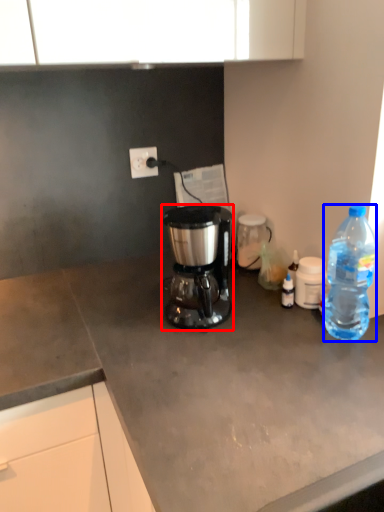
Question: Which object appears farthest to the camera in this image, coffee maker (highlighted by a red box) or bottle (highlighted by a blue box)?

Choices:
 (A) coffee maker
 (B) bottle

Answer: (A)